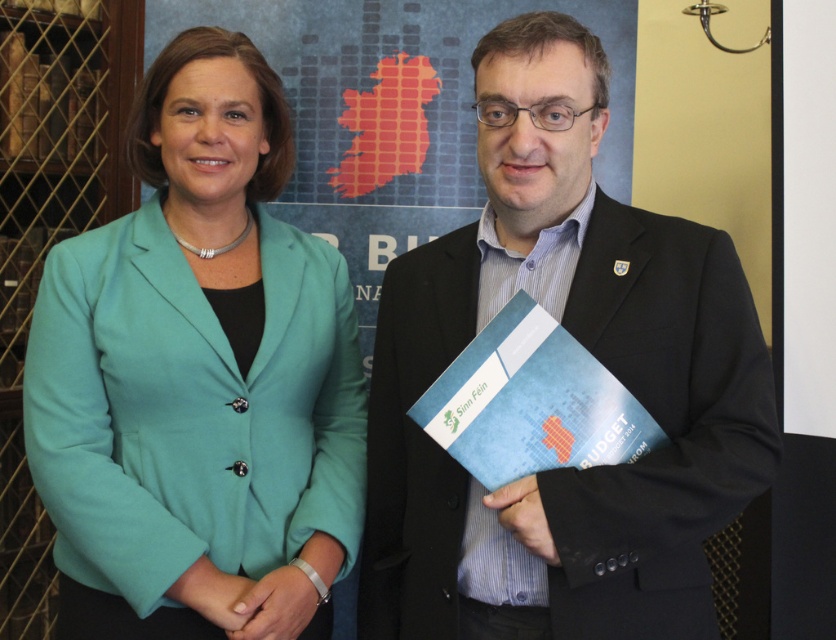
You are a photographer setting up for a group photo. You notice the teal fabric jacket at center and the matte black suit at center. Which one is positioned higher in the frame?

The teal fabric jacket at center is located above the matte black suit at center, so it is positioned higher in the frame.

You are a photographer setting up for a group photo. You need to position two people so that their jackets are visible. The teal fabric jacket at center must be to the left of the matte black suit at center. Based on the scene description, where should each person stand relative to each other?

The teal fabric jacket at center should be positioned to the left of the matte black suit at center, as described in the scene. Therefore, the person wearing the teal fabric jacket at center should stand to the left of the person in the matte black suit at center to ensure their jackets are visible in the correct spatial arrangement.

You are a photographer setting up for a group photo. You need to ensure that the teal fabric jacket at center and the matte black suit at center are at least 14 inches apart for proper framing. Based on the current setup, can you confirm if they meet this requirement?

The teal fabric jacket at center is 13.58 inches from the matte black suit at center, which is slightly less than the required 14 inches. Therefore, they do not currently meet the framing requirement and need to be moved further apart.